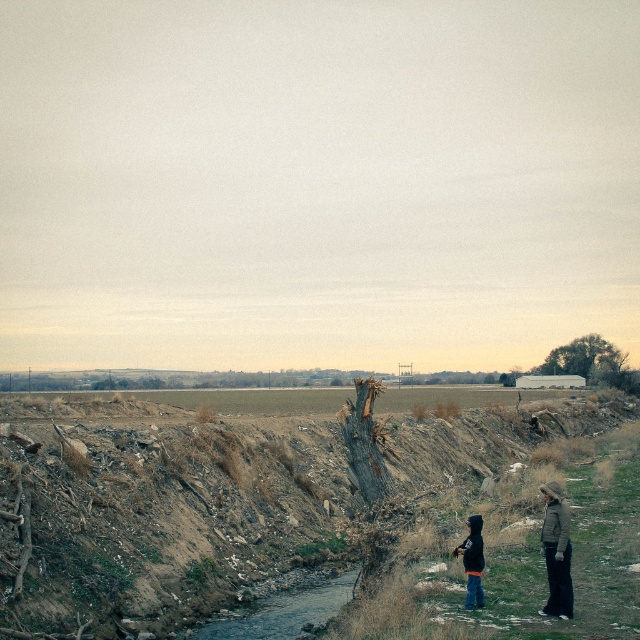
Question: Which object is closer to the camera taking this photo?

Choices:
 (A) khaki woolen jacket at right
 (B) clear water at center
 (C) dark gray hoodie at center
 (D) black matte jacket at lower right

Answer: (A)

Question: Which is nearer to the black matte jacket at lower right?

Choices:
 (A) dark gray hoodie at center
 (B) khaki woolen jacket at right

Answer: (B)

Question: Does clear water at center have a smaller size compared to dark gray hoodie at center?

Choices:
 (A) yes
 (B) no

Answer: (A)

Question: Among these objects, which one is nearest to the camera?

Choices:
 (A) khaki woolen jacket at right
 (B) black matte jacket at lower right
 (C) dark gray hoodie at center

Answer: (A)

Question: Does dark gray hoodie at center have a larger size compared to black matte jacket at lower right?

Choices:
 (A) no
 (B) yes

Answer: (A)

Question: Is clear water at center closer to camera compared to black matte jacket at lower right?

Choices:
 (A) yes
 (B) no

Answer: (B)